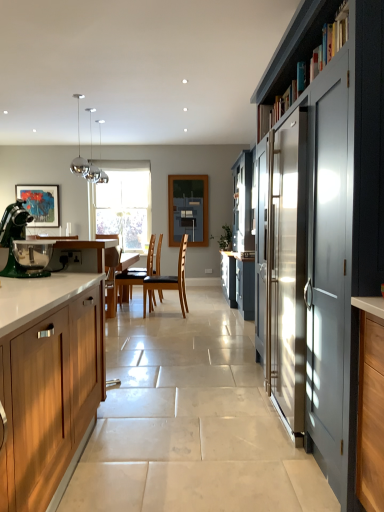
Locate an element on the screen. wooden cabinet at left, placed as the 1th cabinetry when sorted from left to right is located at coordinates (48, 381).

Find the location of a particular element. The image size is (384, 512). blue painted wood window screen at center is located at coordinates (188, 209).

What is the approximate width of chrome/metallic pendant lights at upper left?

25.25 centimeters.

Describe the element at coordinates (86, 161) in the screenshot. The width and height of the screenshot is (384, 512). I see `chrome/metallic pendant lights at upper left` at that location.

How much space does brown leather chair at center, which is counted as the 2th chair, starting from the left, occupy horizontally?

brown leather chair at center, which is counted as the 2th chair, starting from the left, is 22.18 inches in width.

Describe the element at coordinates (125, 203) in the screenshot. I see `clear glass window at center` at that location.

This screenshot has width=384, height=512. What do you see at coordinates (40, 203) in the screenshot?
I see `matte acrylic painting at left` at bounding box center [40, 203].

Where is `wooden cabinet at left, which is counted as the 2th cabinetry, starting from the right`? Image resolution: width=384 pixels, height=512 pixels. wooden cabinet at left, which is counted as the 2th cabinetry, starting from the right is located at coordinates (48, 381).

Between point (75, 167) and point (132, 244), which one is positioned behind?

The point (132, 244) is behind.

From the picture: Between chrome/metallic pendant lights at upper left and clear glass window at center, which one appears on the left side from the viewer's perspective?

From the viewer's perspective, clear glass window at center appears more on the left side.

Can you tell me how much chrome/metallic pendant lights at upper left and clear glass window at center differ in facing direction?

84.4 degrees separate the facing orientations of chrome/metallic pendant lights at upper left and clear glass window at center.

Who is bigger, chrome/metallic pendant lights at upper left or clear glass window at center?

clear glass window at center.

Does satin grey cabinet at right, positioned as the 1th cabinetry in right-to-left order, have a greater width compared to brown leather chair at center, positioned as the 1th chair in left-to-right order?

Yes, satin grey cabinet at right, positioned as the 1th cabinetry in right-to-left order, is wider than brown leather chair at center, positioned as the 1th chair in left-to-right order.

From a real-world perspective, is satin grey cabinet at right, positioned as the 1th cabinetry in right-to-left order, physically above brown leather chair at center, positioned as the second chair in front-to-back order?

Yes, from a real-world perspective, satin grey cabinet at right, positioned as the 1th cabinetry in right-to-left order, is above brown leather chair at center, positioned as the second chair in front-to-back order.

Is satin grey cabinet at right, positioned as the 1th cabinetry in right-to-left order, facing away from brown leather chair at center, which is the 1th chair from back to front?

No, brown leather chair at center, which is the 1th chair from back to front, is not at the back of satin grey cabinet at right, positioned as the 1th cabinetry in right-to-left order.

How different are the orientations of satin grey cabinet at right, the 2th cabinetry positioned from the left, and brown leather chair at center, positioned as the 1th chair in left-to-right order, in degrees?

They differ by 2 degrees in their facing directions.

Who is bigger, green matte stand mixer at left or wooden cabinet at left, which is counted as the 2th cabinetry, starting from the right?

wooden cabinet at left, which is counted as the 2th cabinetry, starting from the right.

Considering the sizes of green matte stand mixer at left and wooden cabinet at left, which is counted as the 2th cabinetry, starting from the right, in the image, is green matte stand mixer at left wider or thinner than wooden cabinet at left, which is counted as the 2th cabinetry, starting from the right,?

Clearly, green matte stand mixer at left has less width compared to wooden cabinet at left, which is counted as the 2th cabinetry, starting from the right.

Consider the image. From the image's perspective, is green matte stand mixer at left on wooden cabinet at left, which is counted as the 2th cabinetry, starting from the right?

Yes.

From a real-world perspective, between green matte stand mixer at left and wooden cabinet at left, which is counted as the 2th cabinetry, starting from the right, who is vertically higher?

green matte stand mixer at left, from a real-world perspective.

From the image's perspective, which is above, satin grey cabinet at right, the 2th cabinetry positioned from the left, or chrome/metallic pendant lights at upper left?

chrome/metallic pendant lights at upper left appears higher in the image.

From a real-world perspective, is satin grey cabinet at right, the 2th cabinetry positioned from the left, positioned above or below chrome/metallic pendant lights at upper left?

From a real-world perspective, satin grey cabinet at right, the 2th cabinetry positioned from the left, is physically below chrome/metallic pendant lights at upper left.

Can you confirm if satin grey cabinet at right, positioned as the 1th cabinetry in right-to-left order, is wider than chrome/metallic pendant lights at upper left?

Correct, the width of satin grey cabinet at right, positioned as the 1th cabinetry in right-to-left order, exceeds that of chrome/metallic pendant lights at upper left.

From the picture: Is satin grey cabinet at right, the 2th cabinetry positioned from the left, shorter than chrome/metallic pendant lights at upper left?

No, satin grey cabinet at right, the 2th cabinetry positioned from the left, is not shorter than chrome/metallic pendant lights at upper left.

Does matte acrylic painting at left have a smaller size compared to satin grey cabinet at right, the 2th cabinetry positioned from the left?

Indeed, matte acrylic painting at left has a smaller size compared to satin grey cabinet at right, the 2th cabinetry positioned from the left.

Which is closer, (28,202) or (370,155)?

The point (370,155) is more forward.

Is matte acrylic painting at left positioned with its back to satin grey cabinet at right, the 2th cabinetry positioned from the left?

No, matte acrylic painting at left's orientation is not away from satin grey cabinet at right, the 2th cabinetry positioned from the left.

From the image's perspective, would you say matte acrylic painting at left is shown under satin grey cabinet at right, the 2th cabinetry positioned from the left?

No, from the image's perspective, matte acrylic painting at left is not below satin grey cabinet at right, the 2th cabinetry positioned from the left.

Is the position of blue painted wood window screen at center more distant than that of satin grey cabinet at right, the 2th cabinetry positioned from the left?

Yes.

Does point (175, 228) come farther from viewer compared to point (283, 243)?

Yes.

Is blue painted wood window screen at center oriented away from satin grey cabinet at right, positioned as the 1th cabinetry in right-to-left order?

That's not correct — blue painted wood window screen at center is not looking away from satin grey cabinet at right, positioned as the 1th cabinetry in right-to-left order.

Considering the relative sizes of blue painted wood window screen at center and satin grey cabinet at right, the 2th cabinetry positioned from the left, in the image provided, is blue painted wood window screen at center bigger than satin grey cabinet at right, the 2th cabinetry positioned from the left,?

No.

Which object is thinner, brown leather chair at center, the second chair when ordered from right to left, or wooden cabinet at left, placed as the 1th cabinetry when sorted from left to right?

brown leather chair at center, the second chair when ordered from right to left, is thinner.

Based on the photo, considering the sizes of objects brown leather chair at center, positioned as the second chair in front-to-back order, and wooden cabinet at left, which is counted as the 2th cabinetry, starting from the right, in the image provided, who is bigger, brown leather chair at center, positioned as the second chair in front-to-back order, or wooden cabinet at left, which is counted as the 2th cabinetry, starting from the right,?

With larger size is wooden cabinet at left, which is counted as the 2th cabinetry, starting from the right.

Which object is further away from the camera taking this photo, brown leather chair at center, positioned as the 1th chair in left-to-right order, or wooden cabinet at left, placed as the 1th cabinetry when sorted from left to right?

brown leather chair at center, positioned as the 1th chair in left-to-right order, is further from the camera.

From a real-world perspective, is brown leather chair at center, positioned as the 1th chair in left-to-right order, physically below wooden cabinet at left, which is counted as the 2th cabinetry, starting from the right?

Yes.

In the image, there is a chrome/metallic pendant lights at upper left. At what (x,y) coordinates should I click in order to perform the action: click on window below it (from a real-world perspective). Please return your answer as a coordinate pair (x, y). Looking at the image, I should click on (125, 203).

Find the location of a particular element. The width and height of the screenshot is (384, 512). cabinetry above the brown leather chair at center, which is the 1th chair from back to front (from the image's perspective) is located at coordinates (329, 241).

Based on the photo, which object lies nearer to the anchor point chrome/metallic pendant lights at upper left, satin grey cabinet at right, the 2th cabinetry positioned from the left, or matte acrylic painting at left?

matte acrylic painting at left is positioned closer to the anchor chrome/metallic pendant lights at upper left.

Which object lies further to the anchor point chrome/metallic pendant lights at upper left, green matte stand mixer at left or brown leather chair at center, which is the 1th chair from back to front?

The object further to chrome/metallic pendant lights at upper left is green matte stand mixer at left.

Which object lies further to the anchor point wooden cabinet at left, placed as the 1th cabinetry when sorted from left to right, brown leather chair at center, positioned as the 1th chair in left-to-right order, or matte acrylic painting at left?

matte acrylic painting at left is positioned further to the anchor wooden cabinet at left, placed as the 1th cabinetry when sorted from left to right.

Considering their positions, is blue painted wood window screen at center positioned further to green matte stand mixer at left than satin grey cabinet at right, positioned as the 1th cabinetry in right-to-left order?

blue painted wood window screen at center is further to green matte stand mixer at left.

From the image, which object appears to be farther from chrome/metallic pendant lights at upper left, satin grey cabinet at right, the 2th cabinetry positioned from the left, or brown leather chair at center, which is counted as the 2th chair, starting from the left?

satin grey cabinet at right, the 2th cabinetry positioned from the left, is positioned further to the anchor chrome/metallic pendant lights at upper left.

From the image, which object appears to be farther from matte acrylic painting at left, clear glass window at center or blue painted wood window screen at center?

blue painted wood window screen at center is further to matte acrylic painting at left.

Which object lies nearer to the anchor point satin grey cabinet at right, the 2th cabinetry positioned from the left, brown leather chair at center, which is counted as the 2th chair, starting from the left, or clear glass window at center?

The object closer to satin grey cabinet at right, the 2th cabinetry positioned from the left, is brown leather chair at center, which is counted as the 2th chair, starting from the left.

From the image, which object appears to be nearer to brown leather chair at center, which appears as the 1th chair when viewed from the right, green matte stand mixer at left or chrome/metallic pendant lights at upper left?

Among the two, chrome/metallic pendant lights at upper left is located nearer to brown leather chair at center, which appears as the 1th chair when viewed from the right.

The width and height of the screenshot is (384, 512). In order to click on shelf between green matte stand mixer at left and satin grey cabinet at right, positioned as the 1th cabinetry in right-to-left order, from left to right in this screenshot , I will do `click(294, 46)`.

Find the location of a particular element. The image size is (384, 512). kitchen appliance between dark gray wooden shelf at upper right and blue painted wood window screen at center along the z-axis is located at coordinates click(16, 239).

Where is `kitchen appliance located between wooden cabinet at left, placed as the 1th cabinetry when sorted from left to right, and chrome/metallic pendant lights at upper left in the depth direction`? The height and width of the screenshot is (512, 384). kitchen appliance located between wooden cabinet at left, placed as the 1th cabinetry when sorted from left to right, and chrome/metallic pendant lights at upper left in the depth direction is located at coordinates (16, 239).

Where is `picture frame positioned between brown leather chair at center, positioned as the 1th chair in left-to-right order, and clear glass window at center from near to far`? The image size is (384, 512). picture frame positioned between brown leather chair at center, positioned as the 1th chair in left-to-right order, and clear glass window at center from near to far is located at coordinates (40, 203).